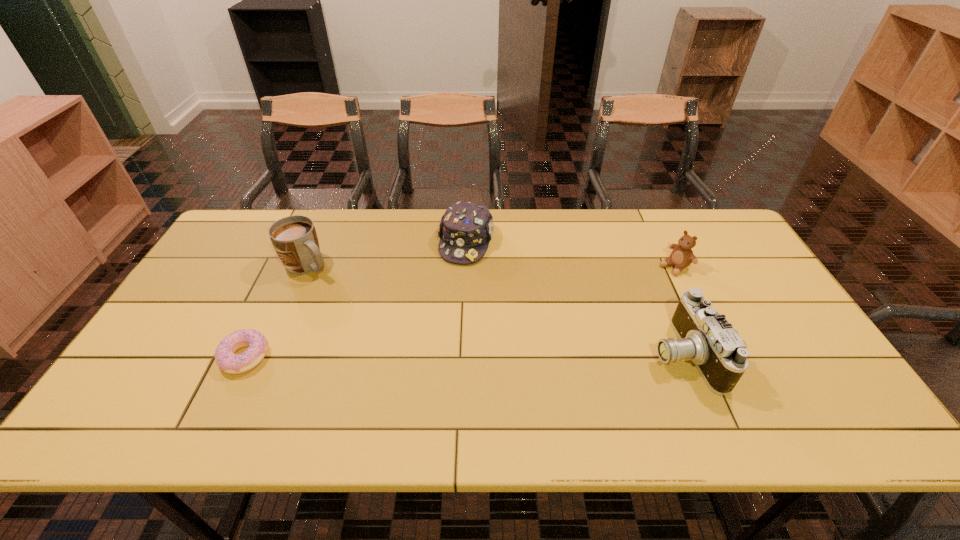
Identify the location of free space in the image that satisfies the following two spatial constraints: 1. on the back side of the mug; 2. on the right side of the shortest object. Image resolution: width=960 pixels, height=540 pixels. (288, 266).

Locate an element on the screen. This screenshot has width=960, height=540. vacant area that satisfies the following two spatial constraints: 1. on the back side of the mug; 2. on the left side of the shortest object is located at coordinates (288, 266).

Find the location of `free location that satisfies the following two spatial constraints: 1. on the front side of the teddy bear; 2. on the left side of the headwear`. free location that satisfies the following two spatial constraints: 1. on the front side of the teddy bear; 2. on the left side of the headwear is located at coordinates (466, 266).